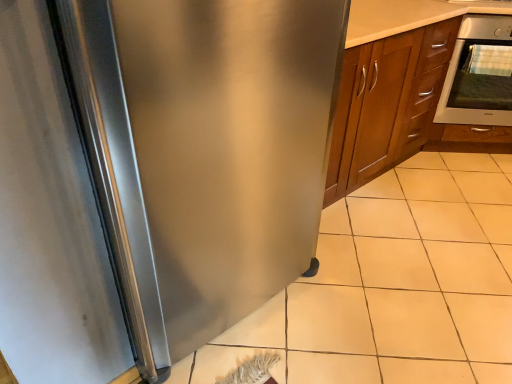
Locate an element on the screen. satin silver oven at upper right is located at coordinates (479, 74).

Identify the location of satin silver oven at upper right. (479, 74).

From a real-world perspective, is satin silver oven at upper right physically below white tile at lower right?

No, from a real-world perspective, satin silver oven at upper right is not below white tile at lower right.

The height and width of the screenshot is (384, 512). Identify the location of tile that is below the satin silver oven at upper right (from the image's perspective). (396, 284).

Looking at their sizes, would you say satin silver oven at upper right is wider or thinner than white tile at lower right?

satin silver oven at upper right is thinner than white tile at lower right.

Does satin silver oven at upper right have a greater height compared to white tile at lower right?

Yes.

There is a satin silver oven at upper right. Find the location of `refrigerator above it (from a real-world perspective)`. refrigerator above it (from a real-world perspective) is located at coordinates (155, 173).

Visually, is satin silver oven at upper right positioned to the left or to the right of stainless steel refrigerator at left?

satin silver oven at upper right is positioned on stainless steel refrigerator at left's right side.

Is satin silver oven at upper right not near stainless steel refrigerator at left?

Yes, satin silver oven at upper right and stainless steel refrigerator at left are quite far apart.

Is white tile at lower right looking in the opposite direction of satin silver oven at upper right?

No, white tile at lower right's orientation is not away from satin silver oven at upper right.

Which object is wider, white tile at lower right or satin silver oven at upper right?

white tile at lower right is wider.

Considering the relative sizes of white tile at lower right and satin silver oven at upper right in the image provided, is white tile at lower right smaller than satin silver oven at upper right?

No, white tile at lower right is not smaller than satin silver oven at upper right.

In the scene shown: From the image's perspective, which one is positioned higher, white tile at lower right or satin silver oven at upper right?

satin silver oven at upper right, from the image's perspective.

From a real-world perspective, is stainless steel refrigerator at left positioned above or below satin silver oven at upper right?

In terms of real-world spatial position, stainless steel refrigerator at left is above satin silver oven at upper right.

You are a GUI agent. You are given a task and a screenshot of the screen. Output one action in this format:
    pyautogui.click(x=<x>, y=<y>)
    Task: Click on the refrigerator located in front of the satin silver oven at upper right
    The width and height of the screenshot is (512, 384).
    Given the screenshot: What is the action you would take?
    (155, 173)

Considering the relative positions of stainless steel refrigerator at left and satin silver oven at upper right in the image provided, is stainless steel refrigerator at left behind satin silver oven at upper right?

No, it is in front of satin silver oven at upper right.

Is stainless steel refrigerator at left facing away from white tile at lower right?

No, stainless steel refrigerator at left is not facing away from white tile at lower right.

Would you say stainless steel refrigerator at left is outside white tile at lower right?

Yes.

Which is closer to the camera, (x=159, y=357) or (x=473, y=224)?

Point (x=159, y=357).

Is stainless steel refrigerator at left not close to white tile at lower right?

No, there isn't a large distance between stainless steel refrigerator at left and white tile at lower right.

Is white tile at lower right looking in the opposite direction of stainless steel refrigerator at left?

white tile at lower right is not turned away from stainless steel refrigerator at left.

Considering the sizes of objects white tile at lower right and stainless steel refrigerator at left in the image provided, who is shorter, white tile at lower right or stainless steel refrigerator at left?

Standing shorter between the two is white tile at lower right.

Consider the image. Can you tell me how much white tile at lower right and stainless steel refrigerator at left differ in facing direction?

The angular difference between white tile at lower right and stainless steel refrigerator at left is 91.1 degrees.

Is white tile at lower right located outside stainless steel refrigerator at left?

white tile at lower right is positioned outside stainless steel refrigerator at left.

The height and width of the screenshot is (384, 512). Find the location of `oven above the white tile at lower right (from a real-world perspective)`. oven above the white tile at lower right (from a real-world perspective) is located at coordinates (479, 74).

Identify the location of refrigerator below the satin silver oven at upper right (from the image's perspective). Image resolution: width=512 pixels, height=384 pixels. (155, 173).

Considering their positions, is white tile at lower right positioned closer to stainless steel refrigerator at left than satin silver oven at upper right?

white tile at lower right.

Looking at the image, which one is located further to satin silver oven at upper right, stainless steel refrigerator at left or white tile at lower right?

stainless steel refrigerator at left lies further to satin silver oven at upper right than the other object.

From the image, which object appears to be nearer to white tile at lower right, stainless steel refrigerator at left or satin silver oven at upper right?

stainless steel refrigerator at left is closer to white tile at lower right.

Considering their positions, is white tile at lower right positioned further to satin silver oven at upper right than stainless steel refrigerator at left?

The object further to satin silver oven at upper right is stainless steel refrigerator at left.

When comparing their distances from stainless steel refrigerator at left, does satin silver oven at upper right or white tile at lower right seem closer?

white tile at lower right is closer to stainless steel refrigerator at left.

Looking at this image, from the image, which object appears to be nearer to white tile at lower right, satin silver oven at upper right or stainless steel refrigerator at left?

The object closer to white tile at lower right is stainless steel refrigerator at left.

You are a GUI agent. You are given a task and a screenshot of the screen. Output one action in this format:
    pyautogui.click(x=<x>, y=<y>)
    Task: Click on the tile situated between stainless steel refrigerator at left and satin silver oven at upper right from left to right
    
    Given the screenshot: What is the action you would take?
    pyautogui.click(x=396, y=284)